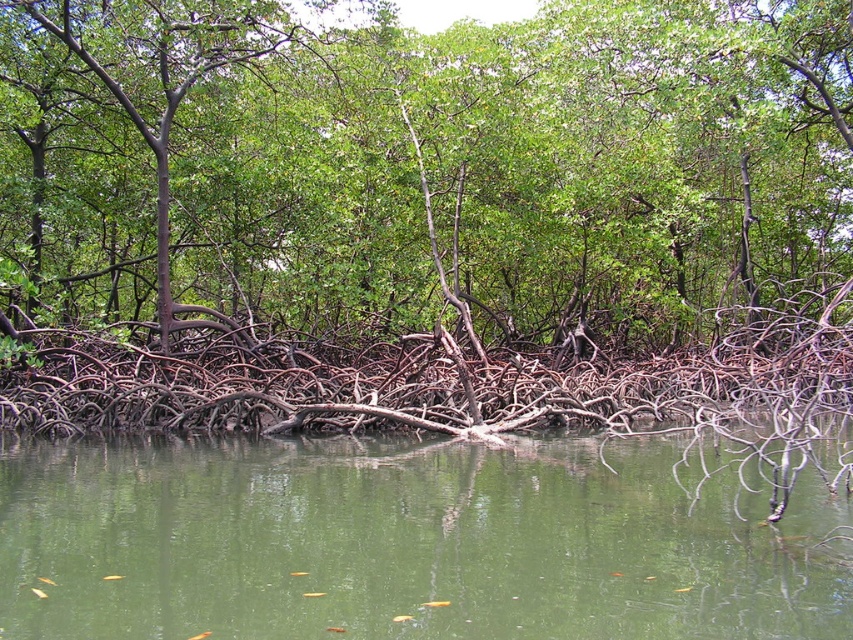
Question: Which of these objects is positioned closest to the green matte tree at center?

Choices:
 (A) green murky water at lower center
 (B) brown rough tree roots at center

Answer: (B)

Question: Where is green murky water at lower center located in relation to green matte tree at center in the image?

Choices:
 (A) above
 (B) below

Answer: (B)

Question: Is brown rough tree roots at center to the right of green matte tree at center from the viewer's perspective?

Choices:
 (A) no
 (B) yes

Answer: (B)

Question: Does green murky water at lower center appear on the right side of green matte tree at center?

Choices:
 (A) yes
 (B) no

Answer: (A)

Question: Among these points, which one is farthest from the camera?

Choices:
 (A) (680, 204)
 (B) (107, 24)
 (C) (497, 493)

Answer: (A)

Question: Which of these objects is positioned farthest from the brown rough tree roots at center?

Choices:
 (A) green matte tree at center
 (B) green murky water at lower center

Answer: (B)